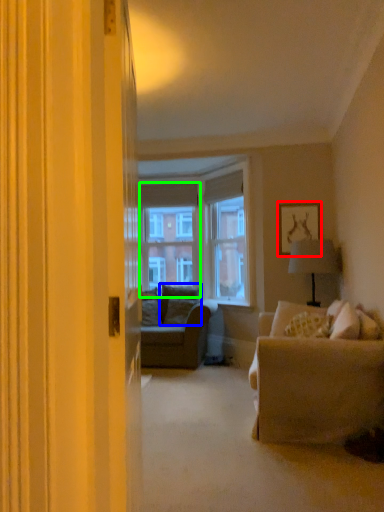
Question: Which object is positioned farthest from picture frame (highlighted by a red box)? Select from pillow (highlighted by a blue box) and window screen (highlighted by a green box).

Choices:
 (A) pillow
 (B) window screen

Answer: (B)